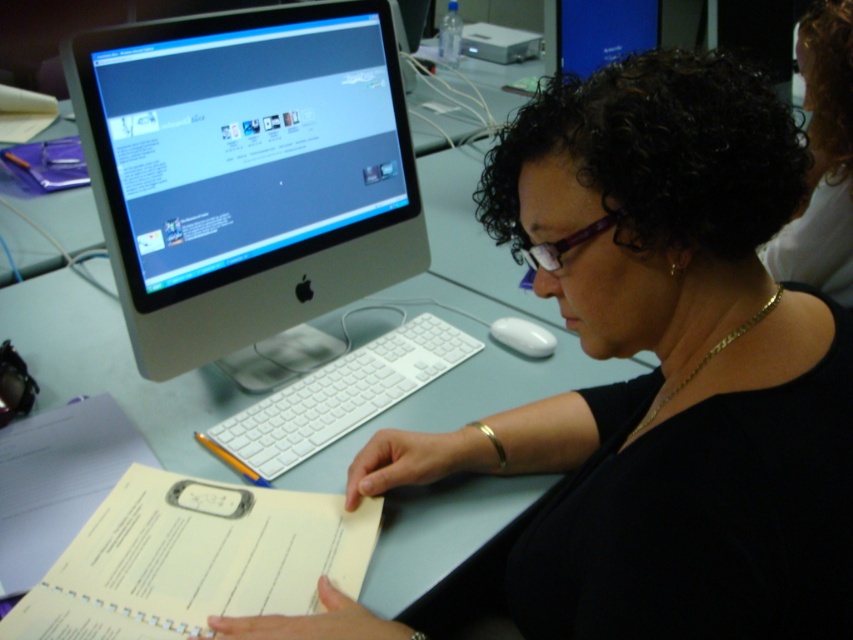
This screenshot has width=853, height=640. Identify the location of black matte computer monitor at upper left. (665, 369).

Between yellow paper at lower left and black glossy hair at upper right, which one has more height?

Standing taller between the two is black glossy hair at upper right.

Does yellow paper at lower left appear on the left side of black glossy hair at upper right?

Indeed, yellow paper at lower left is positioned on the left side of black glossy hair at upper right.

Locate an element on the screen. This screenshot has height=640, width=853. yellow paper at lower left is located at coordinates (194, 560).

Can you confirm if sleek silver monitor at upper left is positioned above yellow paper at lower left?

Yes, sleek silver monitor at upper left is above yellow paper at lower left.

Who is taller, sleek silver monitor at upper left or yellow paper at lower left?

sleek silver monitor at upper left

Describe the element at coordinates (247, 172) in the screenshot. The width and height of the screenshot is (853, 640). I see `sleek silver monitor at upper left` at that location.

You are a GUI agent. You are given a task and a screenshot of the screen. Output one action in this format:
    pyautogui.click(x=<x>, y=<y>)
    Task: Click on the sleek silver monitor at upper left
    The height and width of the screenshot is (640, 853).
    Given the screenshot: What is the action you would take?
    pyautogui.click(x=247, y=172)